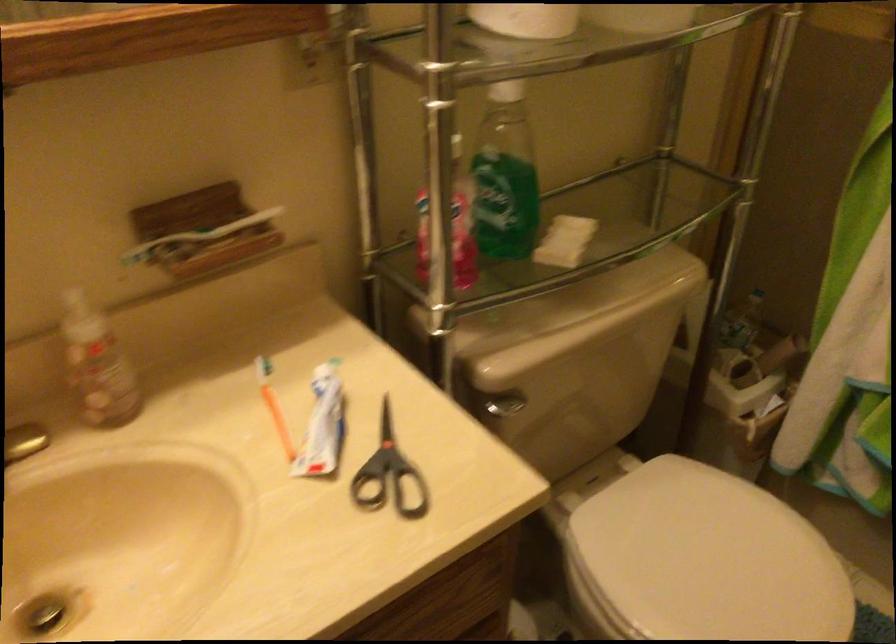
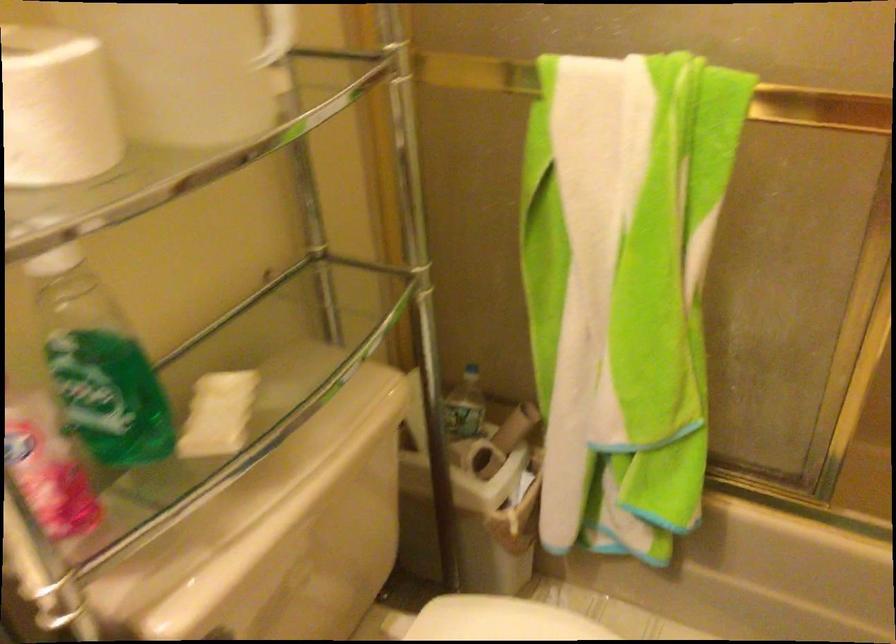
Where in the second image is the point corresponding to the point at 504,176 from the first image?

(98, 365)